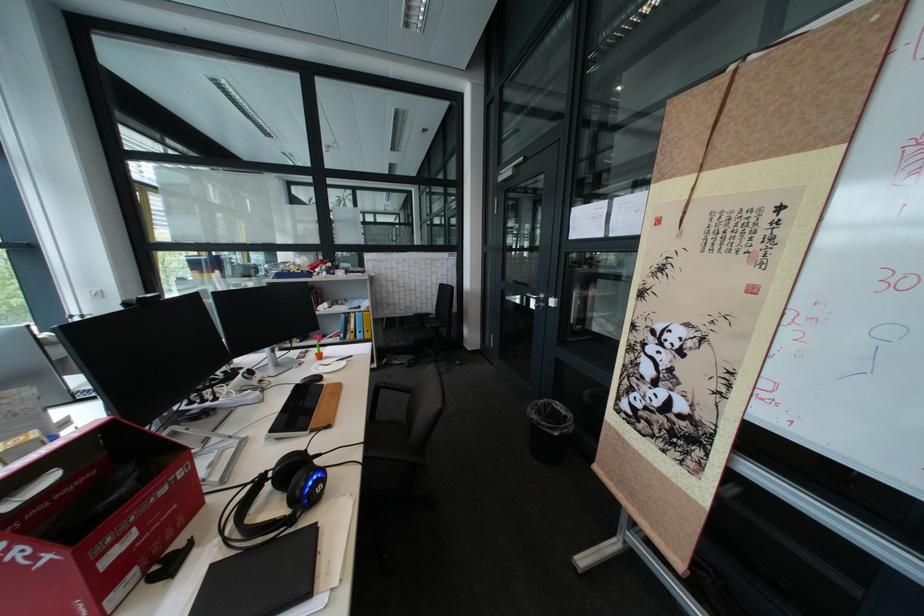
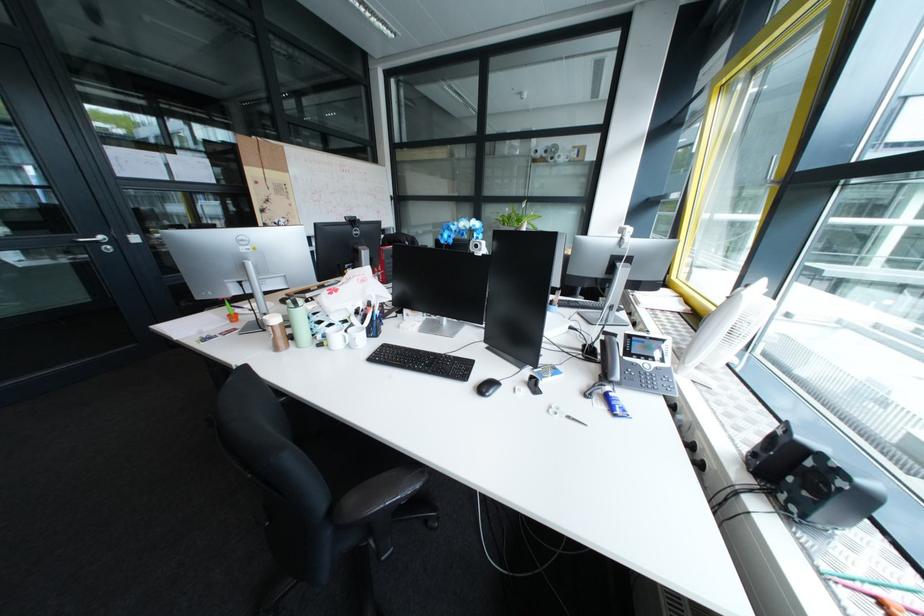
Question: I am providing you with two images of the same scene from different viewpoints. Please identify which objects are invisible in image2.

Choices:
 (A) yellow cylinder
 (B) black chair armrest
 (C) small white saucer
 (D) black webcam

Answer: (C)